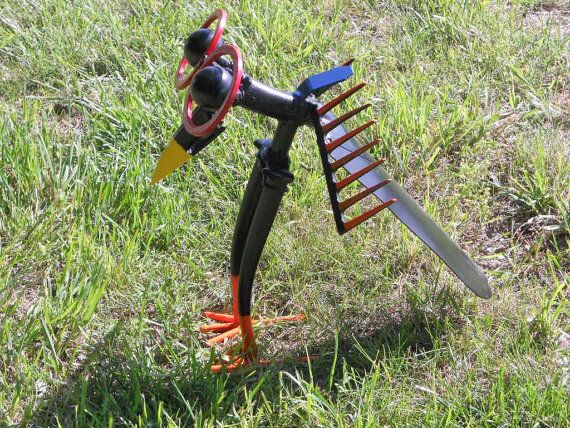
Where is `stand legs`? This screenshot has height=428, width=570. stand legs is located at coordinates (255, 250), (237, 254).